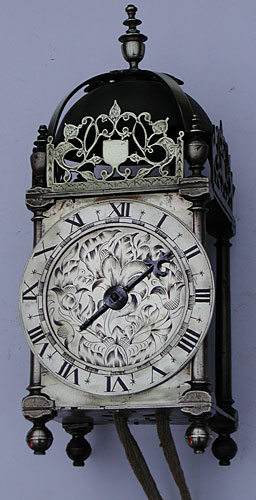
The image size is (256, 500). I want to click on flower designs on inner clock face, so click(x=72, y=297), click(x=176, y=293), click(x=64, y=328).